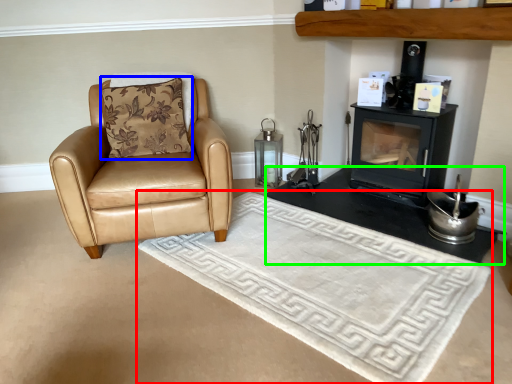
Question: Considering the real-world distances, which object is farthest from mat (highlighted by a red box)? pillow (highlighted by a blue box) or table (highlighted by a green box)?

Choices:
 (A) pillow
 (B) table

Answer: (A)